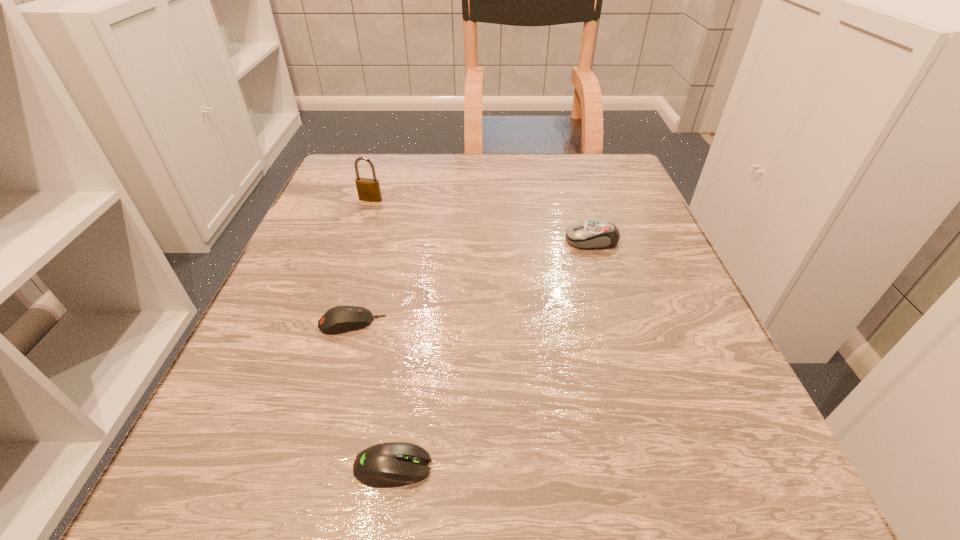
You are a GUI agent. You are given a task and a screenshot of the screen. Output one action in this format:
    pyautogui.click(x=<x>, y=<y>)
    Task: Click on the tallest object
    The image size is (960, 540).
    Given the screenshot: What is the action you would take?
    [368, 189]

Find the location of `the farthest object`. the farthest object is located at coordinates (368, 189).

Find the location of a particular element. Image resolution: width=960 pixels, height=540 pixels. the farthest computer mouse is located at coordinates (595, 234).

Find the location of `the rightmost object`. the rightmost object is located at coordinates (595, 234).

This screenshot has height=540, width=960. In order to click on the second nearest computer mouse in this screenshot , I will do `click(338, 319)`.

Where is `the third farthest object`? The width and height of the screenshot is (960, 540). the third farthest object is located at coordinates (338, 319).

This screenshot has height=540, width=960. Identify the location of the nearest computer mouse. (393, 464).

Locate an element on the screen. The height and width of the screenshot is (540, 960). the second computer mouse from left to right is located at coordinates (393, 464).

Image resolution: width=960 pixels, height=540 pixels. What are the coordinates of `free spot located 0.070m on the right of the farthest object` in the screenshot? It's located at (415, 200).

Find the location of `free region located on the wheel side of the rightmost object`. free region located on the wheel side of the rightmost object is located at coordinates (540, 240).